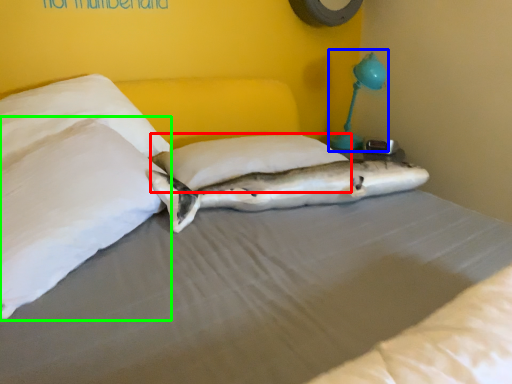
Question: Which is nearer to the pillow (highlighted by a red box)? table lamp (highlighted by a blue box) or pillow (highlighted by a green box).

Choices:
 (A) table lamp
 (B) pillow

Answer: (B)